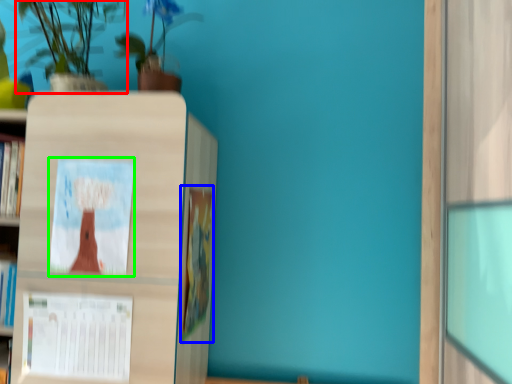
Question: Based on their relative distances, which object is farther from houseplant (highlighted by a red box)? Choose from book (highlighted by a blue box) and book cover (highlighted by a green box).

Choices:
 (A) book
 (B) book cover

Answer: (A)